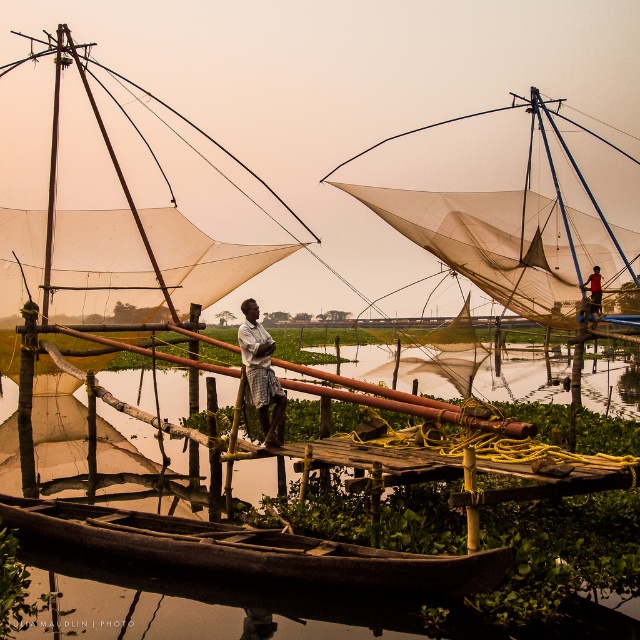
You are a tourist on a boat trip and see the dark brown wooden canoe at lower center and the orange fabric fisherman at right. Which object is positioned to the left of the other?

The dark brown wooden canoe at lower center is positioned to the left of the orange fabric fisherman at right.

You are a tourist visiting this fishing area and want to take a photo of the dark brown wooden canoe at lower center. The camera you have can only focus on objects within a 0.1 unit radius from the point specified. If you set the focus point at coordinates point (x=246, y=550), will the canoe be in focus?

Yes, the point (x=246, y=550) is on the dark brown wooden canoe at lower center, so setting the focus there will ensure the canoe is in focus.

What is the 2D coordinate of the dark brown wooden canoe at lower center in the image?

The dark brown wooden canoe at lower center is located at the 2D coordinate point of (246, 550).